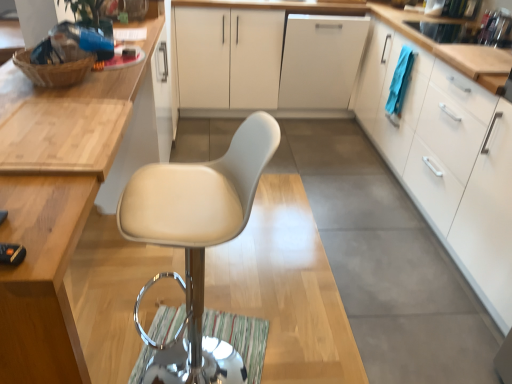
The height and width of the screenshot is (384, 512). Identify the location of free space to the right of white leather chair at center. (298, 348).